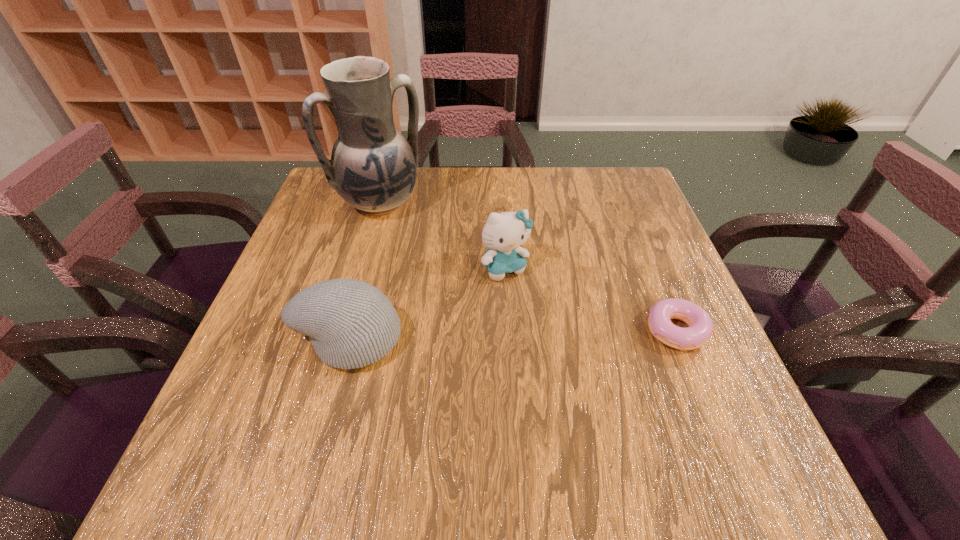
Locate an element on the screen. The height and width of the screenshot is (540, 960). empty space that is in between the second object from right to left and the pitcher is located at coordinates (443, 235).

Locate an element on the screen. The width and height of the screenshot is (960, 540). free spot between the kitten and the doughnut is located at coordinates (590, 299).

At what (x,y) coordinates should I click in order to perform the action: click on vacant point located between the third object from left to right and the tallest object. Please return your answer as a coordinate pair (x, y). Looking at the image, I should click on (443, 235).

Where is `empty location between the farthest object and the second farthest object`? empty location between the farthest object and the second farthest object is located at coordinates (443, 235).

Where is `free space between the rightmost object and the kitten`? free space between the rightmost object and the kitten is located at coordinates (590, 299).

Identify the location of free area in between the doughnut and the third tallest object. (512, 334).

Choose which object is the nearest neighbor to the shortest object. Please provide its 2D coordinates. Your answer should be formatted as a tuple, i.e. [(x, y)], where the tuple contains the x and y coordinates of a point satisfying the conditions above.

[(503, 233)]

You are a GUI agent. You are given a task and a screenshot of the screen. Output one action in this format:
    pyautogui.click(x=<x>, y=<y>)
    Task: Click on the object that is the third closest to the tallest object
    This screenshot has width=960, height=540.
    Given the screenshot: What is the action you would take?
    pyautogui.click(x=700, y=328)

The image size is (960, 540). Find the location of `free space that satisfies the following two spatial constraints: 1. on the front side of the third object from left to right; 2. on the right side of the doughnut`. free space that satisfies the following two spatial constraints: 1. on the front side of the third object from left to right; 2. on the right side of the doughnut is located at coordinates (509, 330).